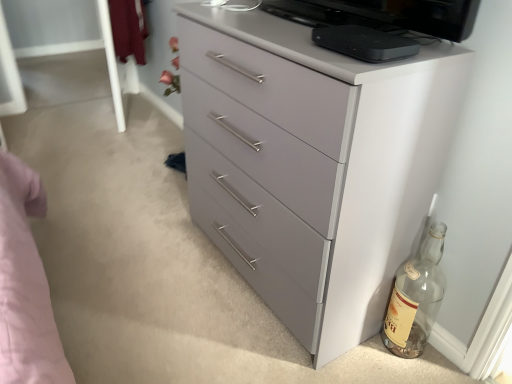
Question: Can you see transparent glass bottle at lower right touching black matte device at upper center?

Choices:
 (A) yes
 (B) no

Answer: (B)

Question: Can you confirm if transparent glass bottle at lower right is positioned to the left of black matte device at upper center?

Choices:
 (A) yes
 (B) no

Answer: (B)

Question: From a real-world perspective, is transparent glass bottle at lower right positioned over black matte device at upper center based on gravity?

Choices:
 (A) yes
 (B) no

Answer: (B)

Question: Is transparent glass bottle at lower right facing away from black matte device at upper center?

Choices:
 (A) no
 (B) yes

Answer: (A)

Question: From a real-world perspective, does transparent glass bottle at lower right sit lower than black matte device at upper center?

Choices:
 (A) yes
 (B) no

Answer: (A)

Question: In the image, is transparent glass bottle at lower right positioned in front of or behind black matte device at upper center?

Choices:
 (A) behind
 (B) front

Answer: (A)

Question: From the image's perspective, is transparent glass bottle at lower right above or below black matte device at upper center?

Choices:
 (A) below
 (B) above

Answer: (A)

Question: Would you say transparent glass bottle at lower right is inside or outside black matte device at upper center?

Choices:
 (A) outside
 (B) inside

Answer: (A)

Question: From a real-world perspective, relative to black matte device at upper center, is transparent glass bottle at lower right vertically above or below?

Choices:
 (A) above
 (B) below

Answer: (B)

Question: Considering the positions of black matte device at upper center and transparent glass bottle at lower right in the image, is black matte device at upper center wider or thinner than transparent glass bottle at lower right?

Choices:
 (A) thin
 (B) wide

Answer: (B)

Question: Is black matte device at upper center in front of or behind transparent glass bottle at lower right in the image?

Choices:
 (A) front
 (B) behind

Answer: (A)

Question: Looking at the image, does black matte device at upper center seem bigger or smaller compared to transparent glass bottle at lower right?

Choices:
 (A) small
 (B) big

Answer: (A)

Question: Visually, is black matte device at upper center positioned to the left or to the right of transparent glass bottle at lower right?

Choices:
 (A) right
 (B) left

Answer: (B)

Question: Is transparent glass bottle at lower right inside or outside of matte gray chest of drawers at center?

Choices:
 (A) outside
 (B) inside

Answer: (A)

Question: From the image's perspective, is transparent glass bottle at lower right positioned above or below matte gray chest of drawers at center?

Choices:
 (A) above
 (B) below

Answer: (B)